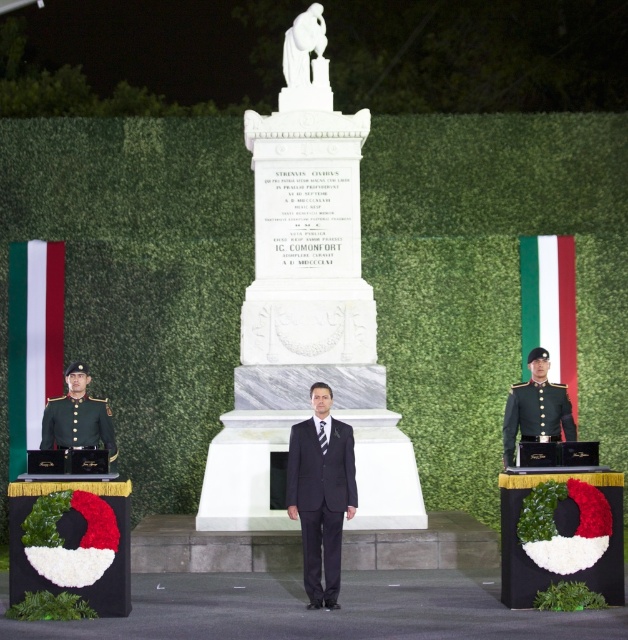
Who is positioned more to the left, dark gray suit at center or green uniform at left?

From the viewer's perspective, green uniform at left appears more on the left side.

The width and height of the screenshot is (628, 640). In order to click on dark gray suit at center in this screenshot , I will do `click(320, 493)`.

Does white marble monument at center have a lesser width compared to green uniform at left?

In fact, white marble monument at center might be wider than green uniform at left.

Image resolution: width=628 pixels, height=640 pixels. What do you see at coordinates (306, 310) in the screenshot? I see `white marble monument at center` at bounding box center [306, 310].

Locate an element on the screen. Image resolution: width=628 pixels, height=640 pixels. white marble monument at center is located at coordinates (306, 310).

Is point (254, 170) positioned in front of point (536, 406)?

No, (254, 170) is behind (536, 406).

Is white marble monument at center shorter than green uniform at right?

No, white marble monument at center is not shorter than green uniform at right.

Does point (259, 128) come in front of point (546, 388)?

No, it is not.

This screenshot has width=628, height=640. I want to click on white marble monument at center, so click(306, 310).